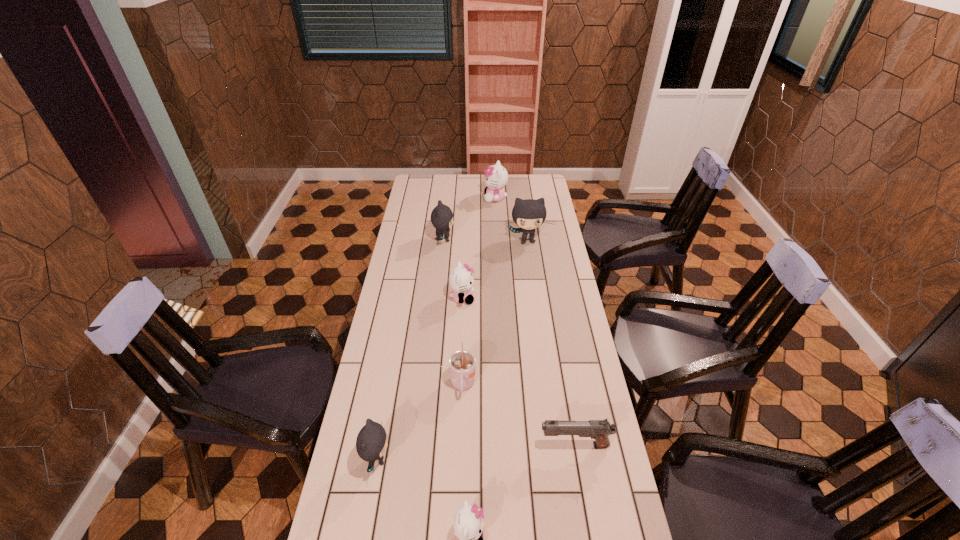
Select which gray kitten is the second closest to the gun. Please provide its 2D coordinates. Your answer should be formatted as a tuple, i.e. [(x, y)], where the tuple contains the x and y coordinates of a point satisfying the conditions above.

[(529, 214)]

The height and width of the screenshot is (540, 960). What are the coordinates of `the third closest white kitten to the gun` in the screenshot? It's located at (496, 177).

Select which white kitten appears as the second closest to the smallest gray kitten. Please provide its 2D coordinates. Your answer should be formatted as a tuple, i.e. [(x, y)], where the tuple contains the x and y coordinates of a point satisfying the conditions above.

[(461, 281)]

Locate an element on the screen. Image resolution: width=960 pixels, height=540 pixels. vacant point that satisfies the following two spatial constraints: 1. on the side with the handle of the fourth nearest object; 2. on the front-facing side of the leftmost kitten is located at coordinates (460, 460).

Locate an element on the screen. free location that satisfies the following two spatial constraints: 1. on the front-facing side of the rightmost gray kitten; 2. on the front-facing side of the leftmost kitten is located at coordinates (557, 460).